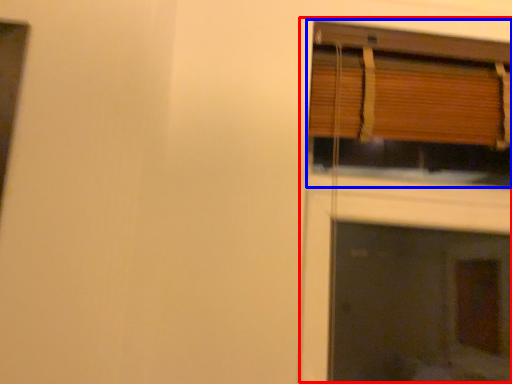
Question: Which object appears closest to the camera in this image, fireplace (highlighted by a red box) or window (highlighted by a blue box)?

Choices:
 (A) fireplace
 (B) window

Answer: (B)